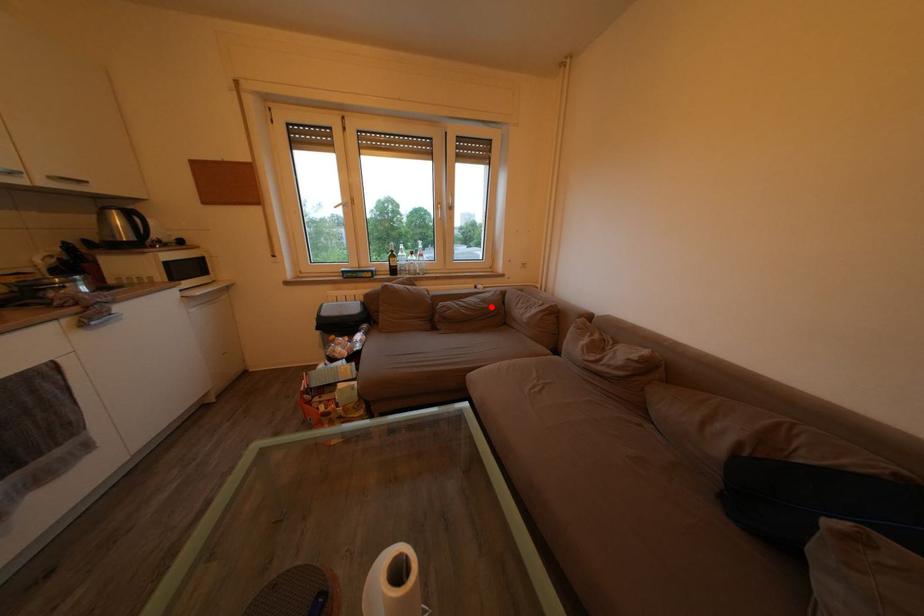
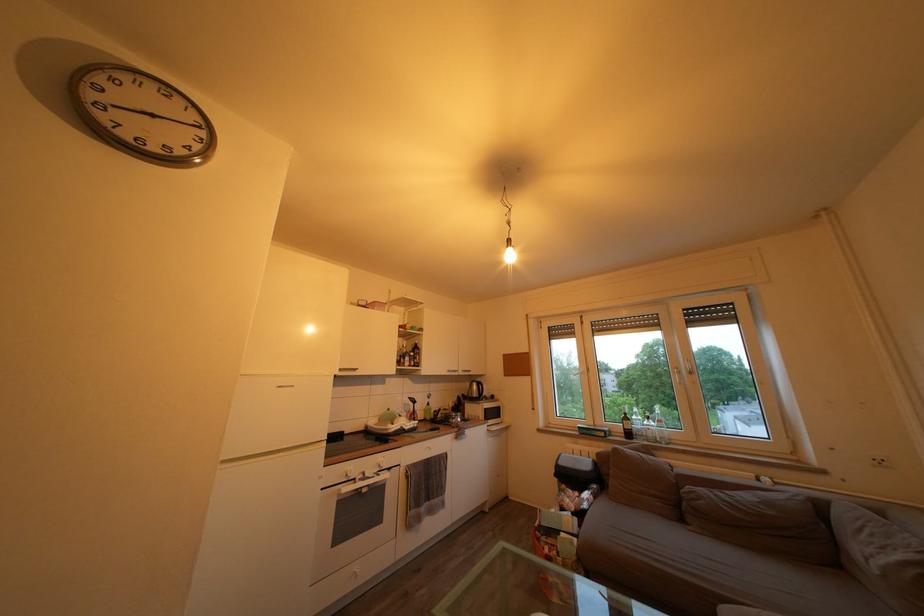
Find the pixel in the second image that matches the highlighted location in the first image.

(774, 509)